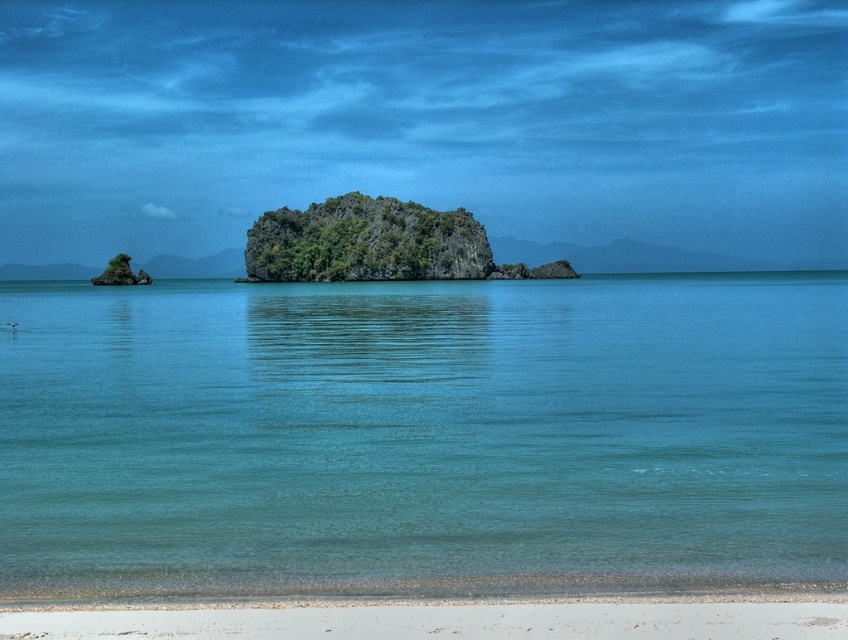
Question: Which point is farther to the camera?

Choices:
 (A) (389, 604)
 (B) (522, 497)

Answer: (B)

Question: Which object appears closest to the camera in this image?

Choices:
 (A) clear blue water at lower center
 (B) white sandy beach at lower center

Answer: (B)

Question: Is clear blue water at lower center bigger than white sandy beach at lower center?

Choices:
 (A) yes
 (B) no

Answer: (A)

Question: Is the position of clear blue water at lower center less distant than that of white sandy beach at lower center?

Choices:
 (A) yes
 (B) no

Answer: (B)

Question: Can you confirm if clear blue water at lower center is positioned below white sandy beach at lower center?

Choices:
 (A) yes
 (B) no

Answer: (B)